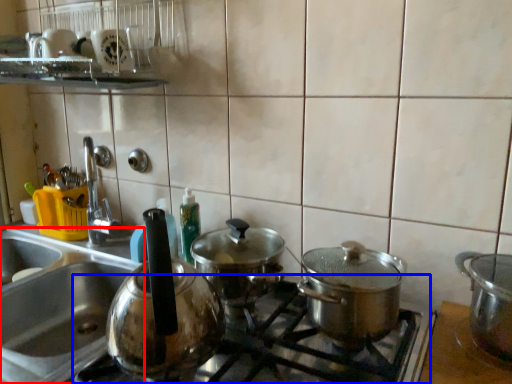
Question: Which of the following is the farthest to the observer, sink (highlighted by a red box) or gas stove (highlighted by a blue box)?

Choices:
 (A) sink
 (B) gas stove

Answer: (A)